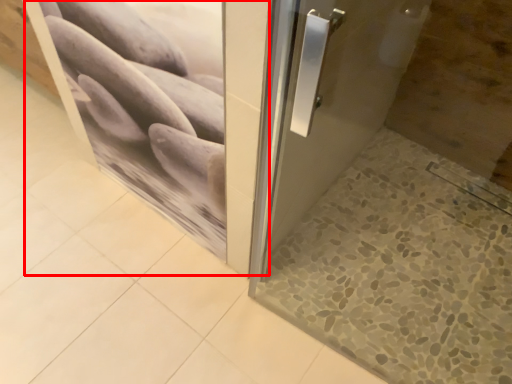
Question: From the image's perspective, what is the correct spatial positioning of screen door (annotated by the red box) in reference to tile?

Choices:
 (A) above
 (B) below

Answer: (A)